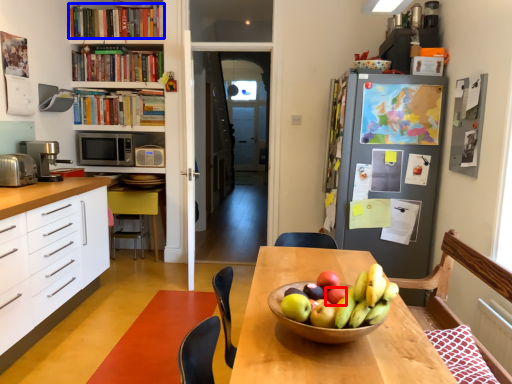
Question: Which object is further to the camera taking this photo, apple (highlighted by a red box) or book (highlighted by a blue box)?

Choices:
 (A) apple
 (B) book

Answer: (B)